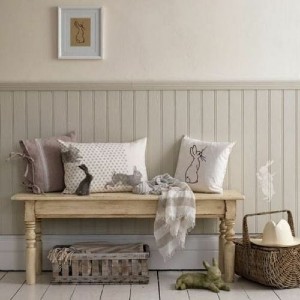
This screenshot has width=300, height=300. What are the coordinates of `white frame` in the screenshot? It's located at (101, 48), (101, 153).